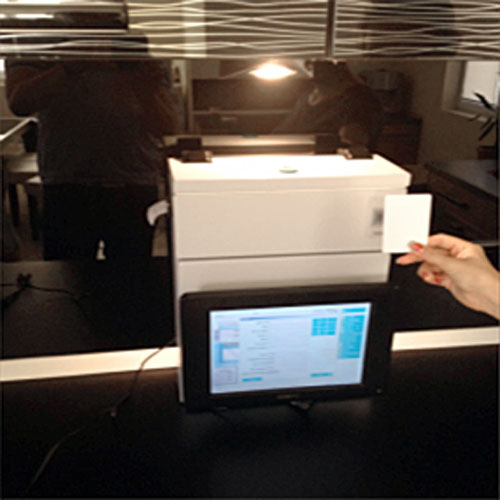
Find the location of a particular element. The height and width of the screenshot is (500, 500). screen is located at coordinates (280, 344).